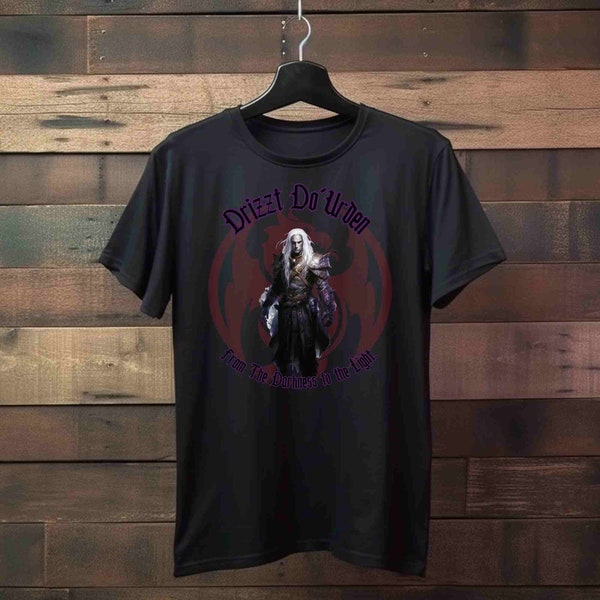
Locate an element on the screen. The height and width of the screenshot is (600, 600). black plastic clothes hanger is located at coordinates (312, 81).